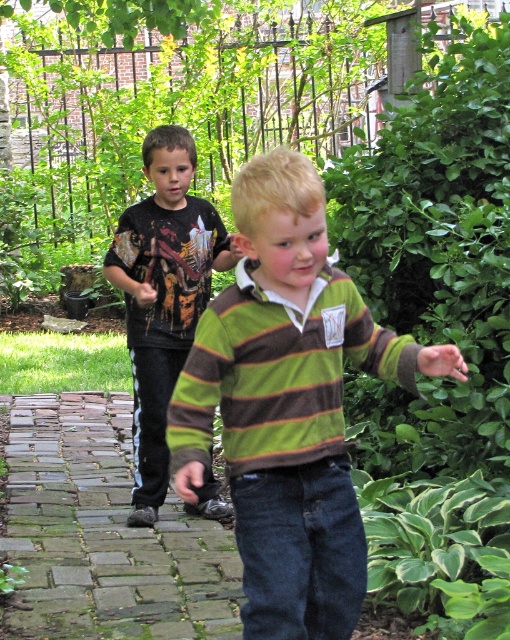
Question: Which of the following is the farthest from the observer?

Choices:
 (A) (201, 356)
 (B) (104, 579)
 (C) (135, 440)

Answer: (C)

Question: Can you confirm if green striped sweater at center is thinner than matte black t-shirt at left?

Choices:
 (A) no
 (B) yes

Answer: (A)

Question: Among these points, which one is farthest from the camera?

Choices:
 (A) (282, 440)
 (B) (207, 492)
 (C) (54, 497)

Answer: (C)

Question: Based on their relative distances, which object is farther from the green striped sweater at center?

Choices:
 (A) matte black t-shirt at left
 (B) brick paved path at center

Answer: (A)

Question: Can you confirm if brick paved path at center is wider than matte black t-shirt at left?

Choices:
 (A) no
 (B) yes

Answer: (B)

Question: Does brick paved path at center have a greater width compared to matte black t-shirt at left?

Choices:
 (A) yes
 (B) no

Answer: (A)